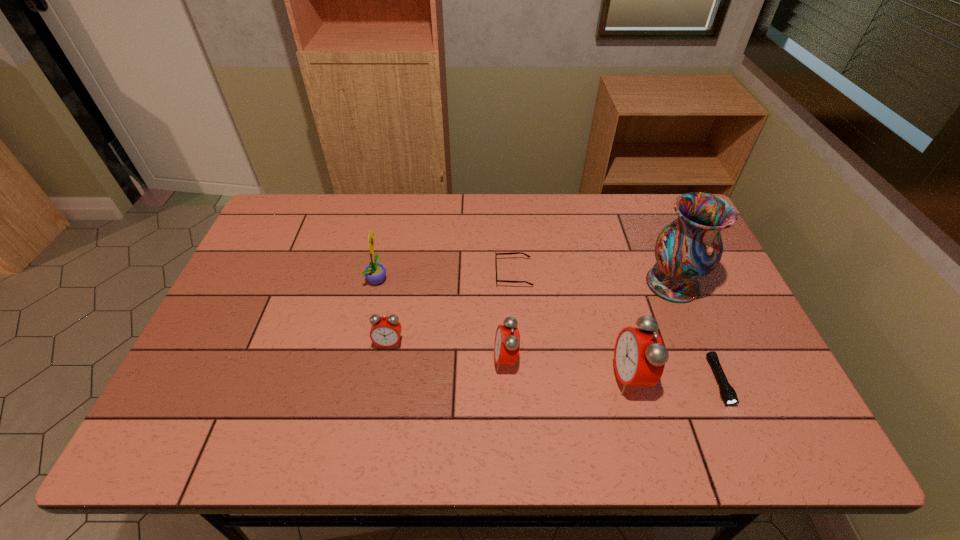
The image size is (960, 540). Identify the location of vacant space situated 0.060m on the front-facing side of the sunglasses. (475, 273).

Locate an element on the screen. The width and height of the screenshot is (960, 540). vacant point located 0.220m on the front-facing side of the sunflower is located at coordinates (463, 279).

Identify the location of flashlight that is at the near edge. (728, 393).

Identify the location of vase present at the right edge. (689, 248).

This screenshot has width=960, height=540. What are the coordinates of `flashlight situated at the right edge` in the screenshot? It's located at coord(728,393).

In order to click on object that is at the near right corner in this screenshot , I will do `click(728, 393)`.

Locate an element on the screen. vacant space at the far edge of the desktop is located at coordinates (431, 210).

Locate an element on the screen. free space at the near edge is located at coordinates (574, 384).

Locate an element on the screen. The height and width of the screenshot is (540, 960). vacant space at the left edge of the desktop is located at coordinates (263, 249).

This screenshot has height=540, width=960. What are the coordinates of `free location at the right edge` in the screenshot? It's located at (716, 288).